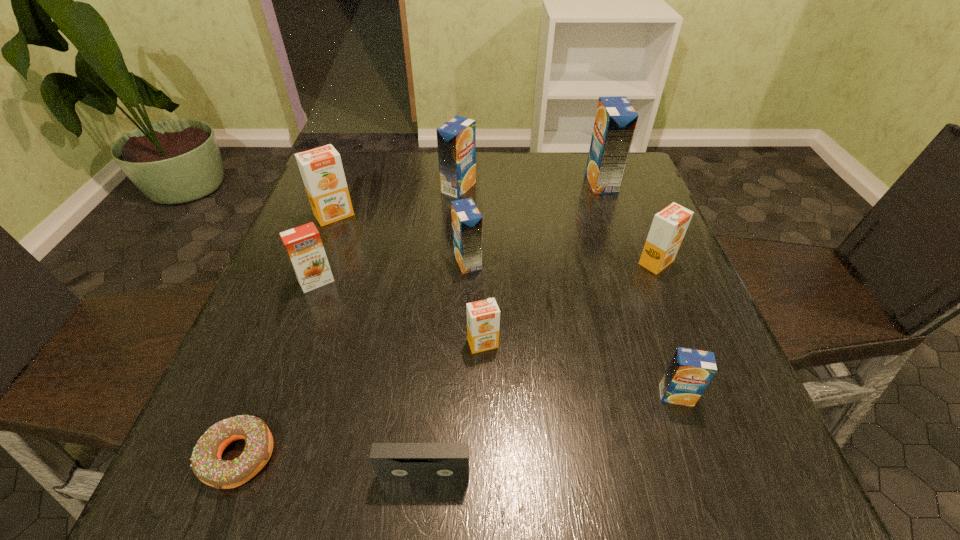
Locate an element on the screen. The image size is (960, 540). the tallest object is located at coordinates (615, 122).

Identify the location of the tallest orange juice. Image resolution: width=960 pixels, height=540 pixels. (615, 122).

Locate an element on the screen. the third smallest blue orange_juice is located at coordinates (456, 139).

Find the location of a particular element. This screenshot has height=540, width=960. the biggest orange orange juice is located at coordinates (321, 168).

This screenshot has height=540, width=960. Find the location of `the third farthest orange juice`. the third farthest orange juice is located at coordinates (321, 168).

What are the coordinates of `the second smallest blue orange_juice` in the screenshot? It's located at (467, 222).

Locate an element on the screen. The image size is (960, 540). the rightmost orange orange juice is located at coordinates (669, 226).

The height and width of the screenshot is (540, 960). In order to click on the nearest orange juice in this screenshot , I will do `click(690, 371)`.

Identify the location of the nearest blue orange_juice. (690, 371).

The width and height of the screenshot is (960, 540). Identify the location of the nearest orange orange juice. (483, 317).